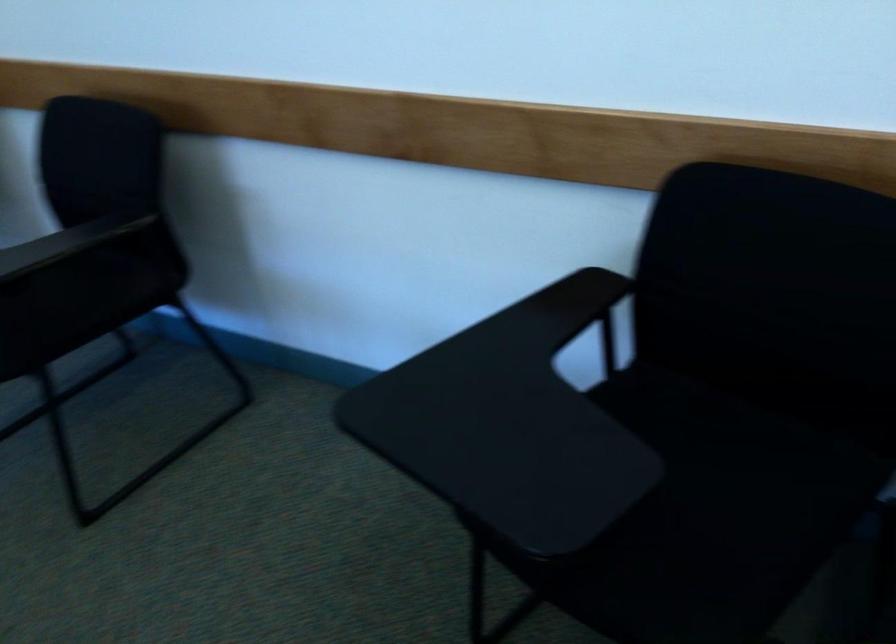
The image size is (896, 644). Describe the element at coordinates (743, 457) in the screenshot. I see `a black chair sitting surface` at that location.